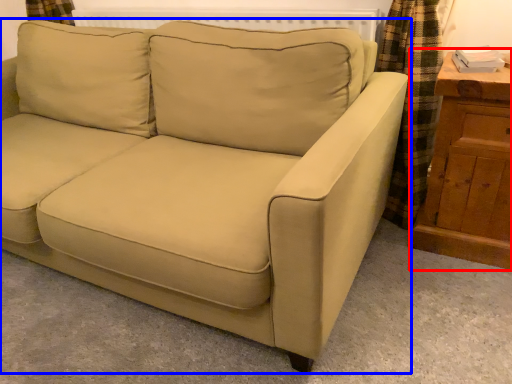
Question: Which object appears closest to the camera in this image, dresser (highlighted by a red box) or studio couch (highlighted by a blue box)?

Choices:
 (A) dresser
 (B) studio couch

Answer: (B)